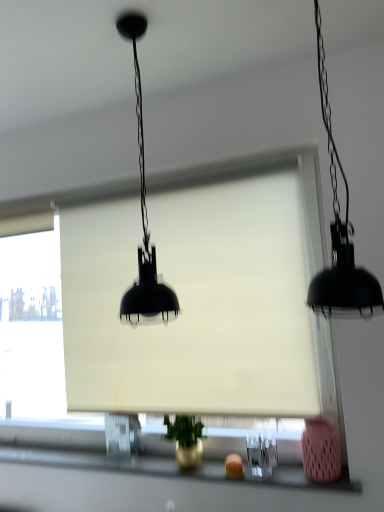
Image resolution: width=384 pixels, height=512 pixels. What do you see at coordinates (166, 468) in the screenshot?
I see `metallic gold vase at lower center` at bounding box center [166, 468].

What do you see at coordinates (340, 234) in the screenshot? I see `black matte pendant light at right, the 1th lamp viewed from the right` at bounding box center [340, 234].

Identify the location of white matte window screen at center. The width and height of the screenshot is (384, 512). (200, 296).

How different are the orientations of black matte pendant light at right, the 1th lamp viewed from the right, and white matte window screen at center in degrees?

→ The angular difference between black matte pendant light at right, the 1th lamp viewed from the right, and white matte window screen at center is 0.714 degrees.

Between black matte pendant light at right, the 1th lamp viewed from the right, and white matte window screen at center, which one has less height?

Standing shorter between the two is black matte pendant light at right, the 1th lamp viewed from the right.

Who is more distant, black matte pendant light at right, which is the second lamp in left-to-right order, or white matte window screen at center?

white matte window screen at center is more distant.

Considering the relative positions of metallic gold vase at lower center and matte black lampshade at center, marked as the 2th lamp in a right-to-left arrangement, in the image provided, is metallic gold vase at lower center behind matte black lampshade at center, marked as the 2th lamp in a right-to-left arrangement,?

Yes, it is behind matte black lampshade at center, marked as the 2th lamp in a right-to-left arrangement.

The height and width of the screenshot is (512, 384). I want to click on window sill below the matte black lampshade at center, marked as the 2th lamp in a right-to-left arrangement (from a real-world perspective), so [x=166, y=468].

From a real-world perspective, who is located higher, metallic gold vase at lower center or matte black lampshade at center, marked as the 2th lamp in a right-to-left arrangement?

matte black lampshade at center, marked as the 2th lamp in a right-to-left arrangement, from a real-world perspective.

Could you tell me if metallic gold vase at lower center is facing matte black lampshade at center, marked as the 2th lamp in a right-to-left arrangement?

No, metallic gold vase at lower center is not oriented towards matte black lampshade at center, marked as the 2th lamp in a right-to-left arrangement.

From a real-world perspective, which object rests below the other?

metallic gold vase at lower center is physically lower.

Consider the image. In terms of height, does black matte pendant light at right, which is the second lamp in left-to-right order, look taller or shorter compared to metallic gold vase at lower center?

Clearly, black matte pendant light at right, which is the second lamp in left-to-right order, is taller compared to metallic gold vase at lower center.

Considering the relative sizes of metallic gold vase at lower center and white matte window screen at center in the image provided, is metallic gold vase at lower center smaller than white matte window screen at center?

Yes.

Considering the positions of objects metallic gold vase at lower center and white matte window screen at center in the image provided, who is more to the right, metallic gold vase at lower center or white matte window screen at center?

white matte window screen at center is more to the right.

Considering the positions of objects metallic gold vase at lower center and white matte window screen at center in the image provided, who is behind, metallic gold vase at lower center or white matte window screen at center?

white matte window screen at center is further away from the camera.

Looking at their sizes, would you say white matte window screen at center is wider or thinner than matte black lampshade at center, marked as the 2th lamp in a right-to-left arrangement?

Clearly, white matte window screen at center has less width compared to matte black lampshade at center, marked as the 2th lamp in a right-to-left arrangement.

Would you say white matte window screen at center contains matte black lampshade at center, the 1th lamp when ordered from left to right?

No, matte black lampshade at center, the 1th lamp when ordered from left to right, is located outside of white matte window screen at center.

Does point (198, 395) come behind point (137, 292)?

Yes, point (198, 395) is farther from viewer.

Who is shorter, white matte window screen at center or matte black lampshade at center, marked as the 2th lamp in a right-to-left arrangement?

With less height is matte black lampshade at center, marked as the 2th lamp in a right-to-left arrangement.

Which is more to the left, black matte pendant light at right, which is the second lamp in left-to-right order, or matte black lampshade at center, marked as the 2th lamp in a right-to-left arrangement?

From the viewer's perspective, matte black lampshade at center, marked as the 2th lamp in a right-to-left arrangement, appears more on the left side.

Which object is further away from the camera taking this photo, black matte pendant light at right, which is the second lamp in left-to-right order, or matte black lampshade at center, marked as the 2th lamp in a right-to-left arrangement?

matte black lampshade at center, marked as the 2th lamp in a right-to-left arrangement.

From a real-world perspective, is black matte pendant light at right, the 1th lamp viewed from the right, physically below matte black lampshade at center, the 1th lamp when ordered from left to right?

Yes, from a real-world perspective, black matte pendant light at right, the 1th lamp viewed from the right, is under matte black lampshade at center, the 1th lamp when ordered from left to right.

From the image's perspective, is white matte window screen at center located beneath metallic gold vase at lower center?

Incorrect, from the image's perspective, white matte window screen at center is higher than metallic gold vase at lower center.

Is metallic gold vase at lower center at the back of white matte window screen at center?

That's not correct — white matte window screen at center is not looking away from metallic gold vase at lower center.

Where is `window screen above the metallic gold vase at lower center (from a real-world perspective)`? The width and height of the screenshot is (384, 512). window screen above the metallic gold vase at lower center (from a real-world perspective) is located at coordinates (200, 296).

Is white matte window screen at center to the right of metallic gold vase at lower center from the viewer's perspective?

Yes, white matte window screen at center is to the right of metallic gold vase at lower center.

Locate an element on the screen. The width and height of the screenshot is (384, 512). window screen below the black matte pendant light at right, the 1th lamp viewed from the right (from the image's perspective) is located at coordinates (200, 296).

This screenshot has height=512, width=384. Identify the location of the 1st lamp to the right of the metallic gold vase at lower center, starting your count from the anchor. (144, 216).

Looking at the image, which one is located closer to white matte window screen at center, matte black lampshade at center, marked as the 2th lamp in a right-to-left arrangement, or metallic gold vase at lower center?

matte black lampshade at center, marked as the 2th lamp in a right-to-left arrangement.

Based on their spatial positions, is matte black lampshade at center, the 1th lamp when ordered from left to right, or black matte pendant light at right, the 1th lamp viewed from the right, further from metallic gold vase at lower center?

Based on the image, matte black lampshade at center, the 1th lamp when ordered from left to right, appears to be further to metallic gold vase at lower center.

Looking at the image, which one is located further to matte black lampshade at center, the 1th lamp when ordered from left to right, white matte window screen at center or black matte pendant light at right, the 1th lamp viewed from the right?

Based on the image, white matte window screen at center appears to be further to matte black lampshade at center, the 1th lamp when ordered from left to right.

From the image, which object appears to be farther from black matte pendant light at right, which is the second lamp in left-to-right order, white matte window screen at center or matte black lampshade at center, the 1th lamp when ordered from left to right?

white matte window screen at center lies further to black matte pendant light at right, which is the second lamp in left-to-right order, than the other object.

Looking at the image, which one is located further to white matte window screen at center, matte black lampshade at center, marked as the 2th lamp in a right-to-left arrangement, or black matte pendant light at right, which is the second lamp in left-to-right order?

black matte pendant light at right, which is the second lamp in left-to-right order.

Which object lies further to the anchor point black matte pendant light at right, the 1th lamp viewed from the right, metallic gold vase at lower center or white matte window screen at center?

Among the two, metallic gold vase at lower center is located further to black matte pendant light at right, the 1th lamp viewed from the right.

Looking at the image, which one is located further to white matte window screen at center, metallic gold vase at lower center or black matte pendant light at right, the 1th lamp viewed from the right?

Among the two, black matte pendant light at right, the 1th lamp viewed from the right, is located further to white matte window screen at center.

Based on their spatial positions, is white matte window screen at center or metallic gold vase at lower center further from matte black lampshade at center, marked as the 2th lamp in a right-to-left arrangement?

metallic gold vase at lower center.

Find the location of `lamp between black matte pendant light at right, the 1th lamp viewed from the right, and white matte window screen at center in the front-back direction`. lamp between black matte pendant light at right, the 1th lamp viewed from the right, and white matte window screen at center in the front-back direction is located at coordinates (144, 216).

Identify the location of lamp between black matte pendant light at right, the 1th lamp viewed from the right, and metallic gold vase at lower center vertically. (144, 216).

Where is `window screen that lies between matte black lampshade at center, the 1th lamp when ordered from left to right, and metallic gold vase at lower center from top to bottom`? This screenshot has width=384, height=512. window screen that lies between matte black lampshade at center, the 1th lamp when ordered from left to right, and metallic gold vase at lower center from top to bottom is located at coordinates (200, 296).

This screenshot has height=512, width=384. Identify the location of window screen between black matte pendant light at right, the 1th lamp viewed from the right, and metallic gold vase at lower center from top to bottom. (200, 296).